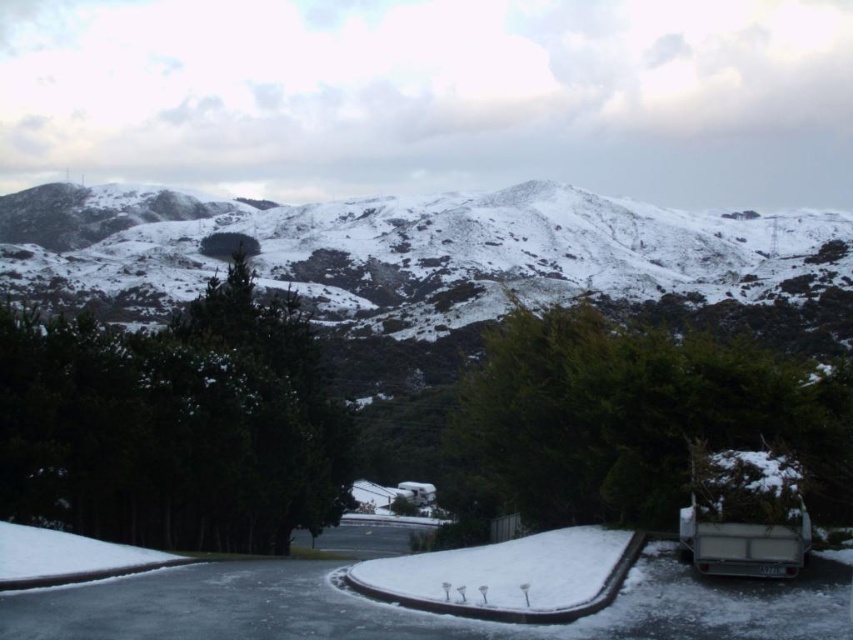
You are standing at the center of the driveway and want to walk to both the point at coordinates point (345, 358) and point (167, 433). Which point will you reach first?

You will reach point (167, 433) first because it is closer to you than point (345, 358), which is further away.

You are standing at the point marked by the coordinates point (173,424). Looking around, you see the green matte tree at center. Which direction should you face to see the green matte tree at center?

The green matte tree at center is located at the coordinates point (173,424), so you are already facing it directly since you are standing at that point.

You are standing at the bottom of the snowy rock formation at upper center and want to walk to the green matte tree at center. Which direction should you head to reach the tree?

You should head downward from the snowy rock formation at upper center to reach the green matte tree at center since the tree is located at a lower elevation than the rock formation.